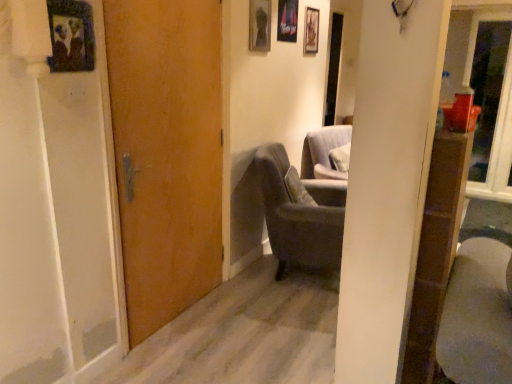
Question: Does transparent glass door at upper right appear on the right side of dark gray fabric chair at center?

Choices:
 (A) no
 (B) yes

Answer: (B)

Question: Is transparent glass door at upper right shorter than dark gray fabric chair at center?

Choices:
 (A) no
 (B) yes

Answer: (A)

Question: Does transparent glass door at upper right come in front of dark gray fabric chair at center?

Choices:
 (A) no
 (B) yes

Answer: (A)

Question: Are transparent glass door at upper right and dark gray fabric chair at center far apart?

Choices:
 (A) yes
 (B) no

Answer: (A)

Question: From a real-world perspective, is transparent glass door at upper right on top of dark gray fabric chair at center?

Choices:
 (A) yes
 (B) no

Answer: (A)

Question: Based on their sizes in the image, would you say metallic silver picture frame at upper center, which ranks as the third picture frame in left-to-right order, is bigger or smaller than matte glass picture frame at upper center, which ranks as the third picture frame in right-to-left order?

Choices:
 (A) big
 (B) small

Answer: (B)

Question: From a real-world perspective, is metallic silver picture frame at upper center, marked as the second picture frame in a right-to-left arrangement, physically located above or below matte glass picture frame at upper center, the third picture frame from the back?

Choices:
 (A) above
 (B) below

Answer: (A)

Question: In terms of height, does metallic silver picture frame at upper center, which ranks as the third picture frame in left-to-right order, look taller or shorter compared to matte glass picture frame at upper center, the third picture frame from the back?

Choices:
 (A) short
 (B) tall

Answer: (B)

Question: Is metallic silver picture frame at upper center, marked as the second picture frame in a right-to-left arrangement, spatially inside matte glass picture frame at upper center, which ranks as the 2th picture frame in left-to-right order, or outside of it?

Choices:
 (A) inside
 (B) outside

Answer: (B)

Question: Based on their sizes in the image, would you say wooden door at center is bigger or smaller than wooden picture frame at upper left, the 1th picture frame from the front?

Choices:
 (A) big
 (B) small

Answer: (A)

Question: Considering the positions of point (173, 16) and point (60, 13), is point (173, 16) closer or farther from the camera than point (60, 13)?

Choices:
 (A) closer
 (B) farther

Answer: (B)

Question: Is wooden door at center wider or thinner than wooden picture frame at upper left, the fourth picture frame viewed from the right?

Choices:
 (A) thin
 (B) wide

Answer: (B)

Question: From a real-world perspective, is wooden door at center physically located above or below wooden picture frame at upper left, the first picture frame viewed from the left?

Choices:
 (A) below
 (B) above

Answer: (A)

Question: Would you say wooden door at center is to the left or to the right of dark gray fabric chair at center in the picture?

Choices:
 (A) right
 (B) left

Answer: (B)

Question: Is wooden door at center wider or thinner than dark gray fabric chair at center?

Choices:
 (A) wide
 (B) thin

Answer: (B)